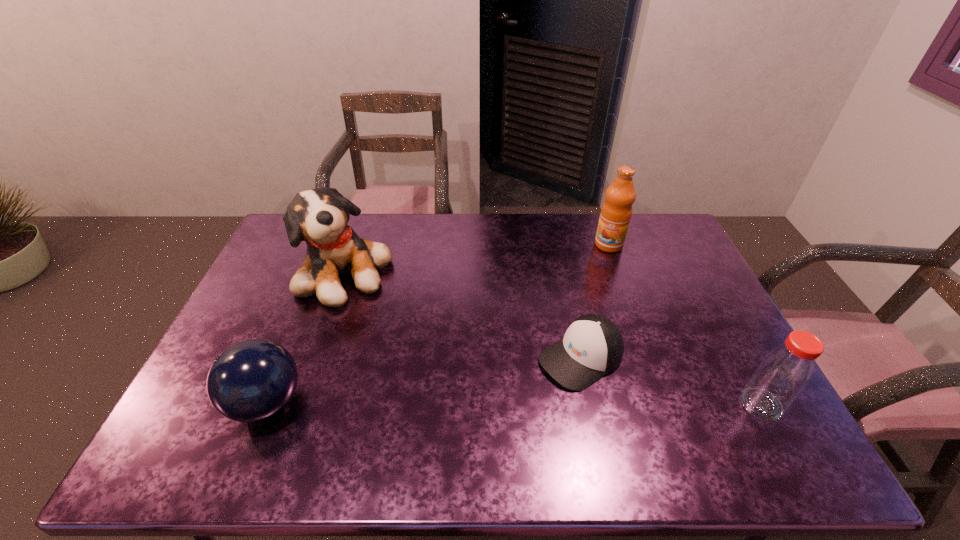
Identify the location of vacant space situated on the front panel of the third object from right to left. (500, 409).

I want to click on vacant region located 0.100m on the front panel of the third object from right to left, so click(519, 396).

Locate an element on the screen. vacant space located on the front panel of the third object from right to left is located at coordinates (531, 388).

The width and height of the screenshot is (960, 540). What are the coordinates of `vacant space located on the label side of the fourth object from left to right` in the screenshot? It's located at (597, 265).

The image size is (960, 540). In order to click on free region located 0.110m on the label side of the fourth object from left to right in this screenshot , I will do `click(593, 270)`.

The width and height of the screenshot is (960, 540). Find the location of `free location located on the label side of the fourth object from left to right`. free location located on the label side of the fourth object from left to right is located at coordinates (582, 290).

Locate an element on the screen. The image size is (960, 540). vacant area situated at the face of the puppy is located at coordinates (444, 357).

Where is `vacant area located at the face of the puppy`? The image size is (960, 540). vacant area located at the face of the puppy is located at coordinates (400, 321).

This screenshot has height=540, width=960. In order to click on free location located at the face of the puppy in this screenshot , I will do `click(449, 361)`.

Where is `fruit juice located at the far edge`? fruit juice located at the far edge is located at coordinates (616, 212).